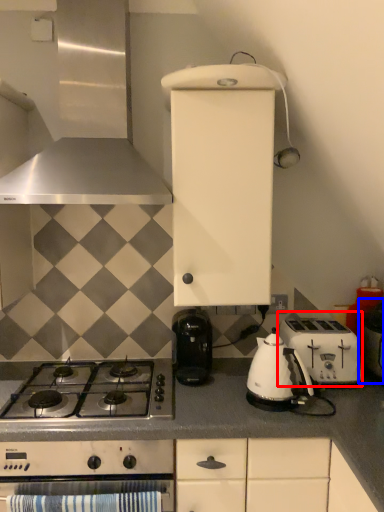
Question: Among these objects, which one is farthest to the camera, toaster (highlighted by a red box) or appliance (highlighted by a blue box)?

Choices:
 (A) toaster
 (B) appliance

Answer: (A)